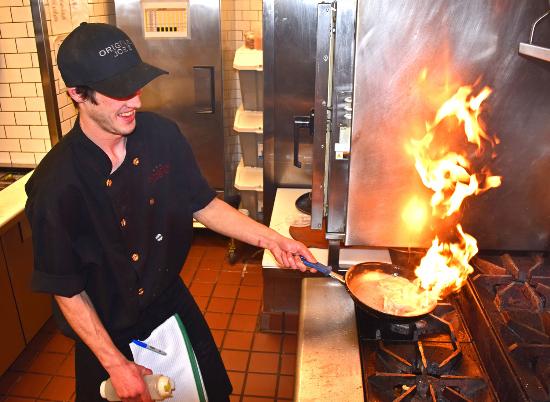
This screenshot has width=550, height=402. Find the location of `squirt bottle`. squirt bottle is located at coordinates (158, 385).